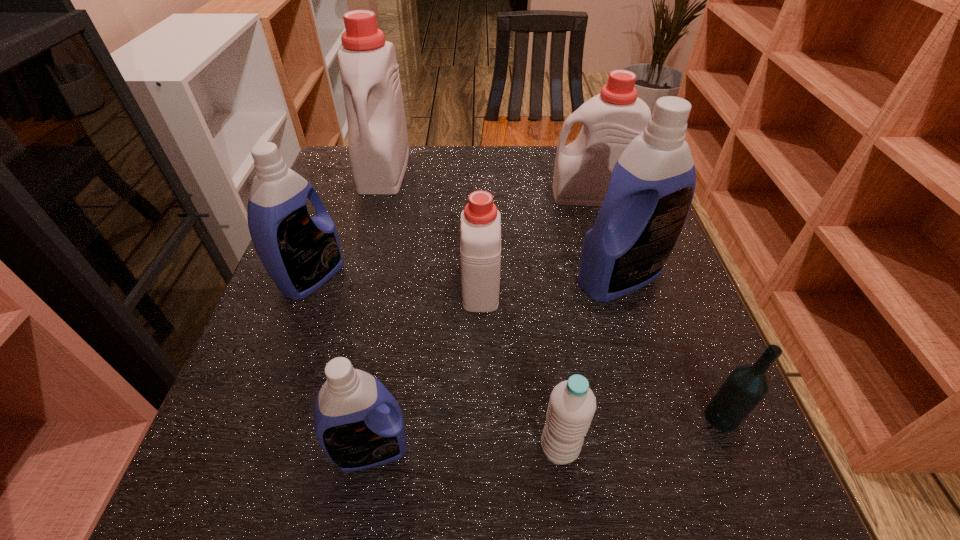
The image size is (960, 540). I want to click on free space located on the right of the smallest blue detergent, so click(443, 449).

Locate an element on the screen. free space located on the back of the vodka is located at coordinates (655, 252).

Locate an element on the screen. Image resolution: width=960 pixels, height=540 pixels. vacant region located 0.170m on the left of the fifth object from left to right is located at coordinates (427, 448).

Image resolution: width=960 pixels, height=540 pixels. Find the location of `detergent at the near edge`. detergent at the near edge is located at coordinates (358, 423).

In order to click on water bottle that is at the near edge in this screenshot , I will do `click(572, 404)`.

Identify the location of vodka present at the right edge. (747, 385).

The height and width of the screenshot is (540, 960). What are the coordinates of `object located at the far left corner` in the screenshot? It's located at (377, 132).

Identify the location of object that is at the far right corner. point(612,119).

This screenshot has height=540, width=960. Identify the location of free space at the far edge of the desktop. (506, 174).

Find the location of a particular element. The image size is (960, 540). blank space at the near edge is located at coordinates (606, 473).